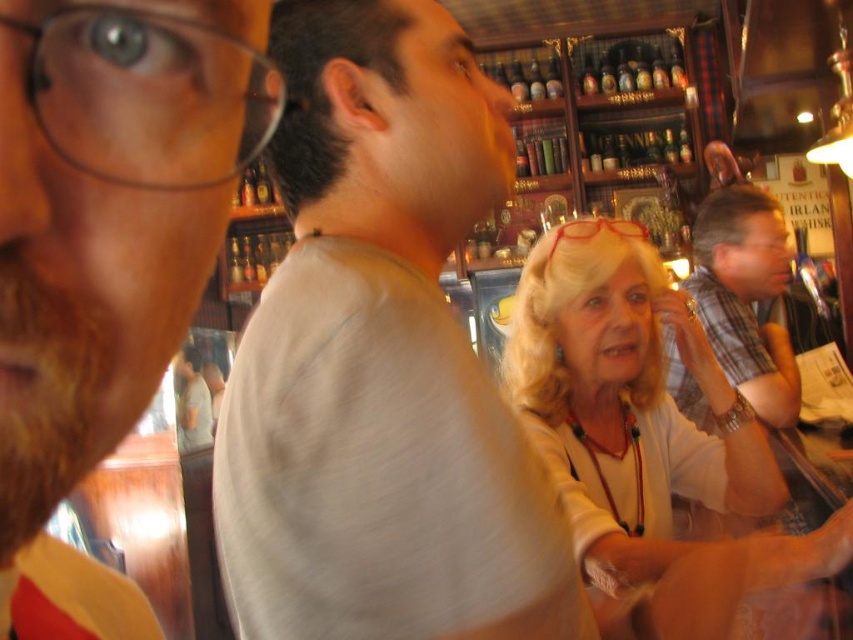
You are a bartender at the bar. You need to deliver a drink to the customer wearing the gray cotton shirt at center and the plaid shirt at right. Which customer should you serve first if you want to serve the one closer to the bar counter first?

The gray cotton shirt at center is above plaid shirt at right, so the gray cotton shirt at center is closer to the bar counter. Serve the gray cotton shirt at center first.

You are standing at the bar and want to hand a drink to both the person at point (306, 548) and the person at point (773, 378). Which person should you serve first to ensure you don

You should serve the person at point (306, 548) first because they are closer to you than the person at point (773, 378).

You are a customer at the bar and want to order a drink. You see the light beige blouse at center and the plaid shirt at right. Which one is closer to the bar counter?

The light beige blouse at center is positioned under the plaid shirt at right, meaning it is closer to the bar counter.